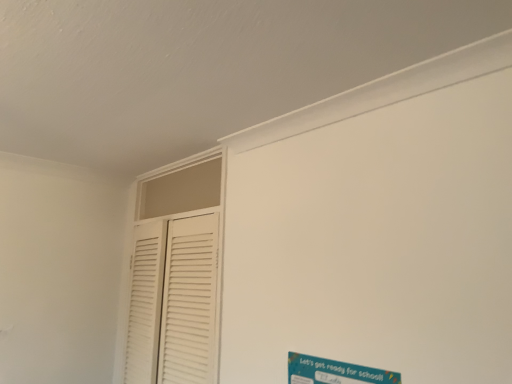
Find the location of a particular element. blue paper poster at lower right is located at coordinates click(x=334, y=372).

Image resolution: width=512 pixels, height=384 pixels. Describe the element at coordinates (334, 372) in the screenshot. I see `blue paper poster at lower right` at that location.

Locate an element on the screen. This screenshot has width=512, height=384. blue paper poster at lower right is located at coordinates (334, 372).